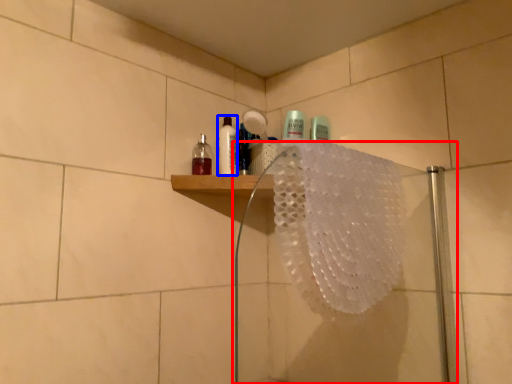
Question: Among these objects, which one is farthest to the camera, shower door (highlighted by a red box) or mouthwash (highlighted by a blue box)?

Choices:
 (A) shower door
 (B) mouthwash

Answer: (B)